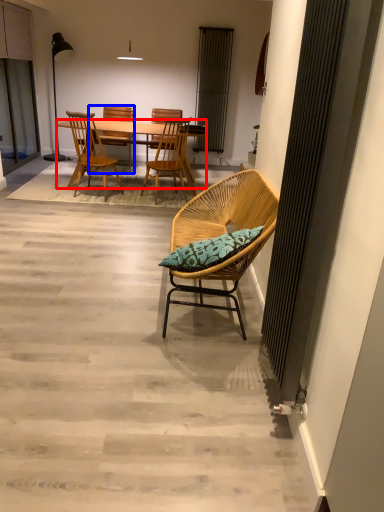
Question: Which of the following is the farthest to the observer, desk (highlighted by a red box) or chair (highlighted by a blue box)?

Choices:
 (A) desk
 (B) chair

Answer: (B)